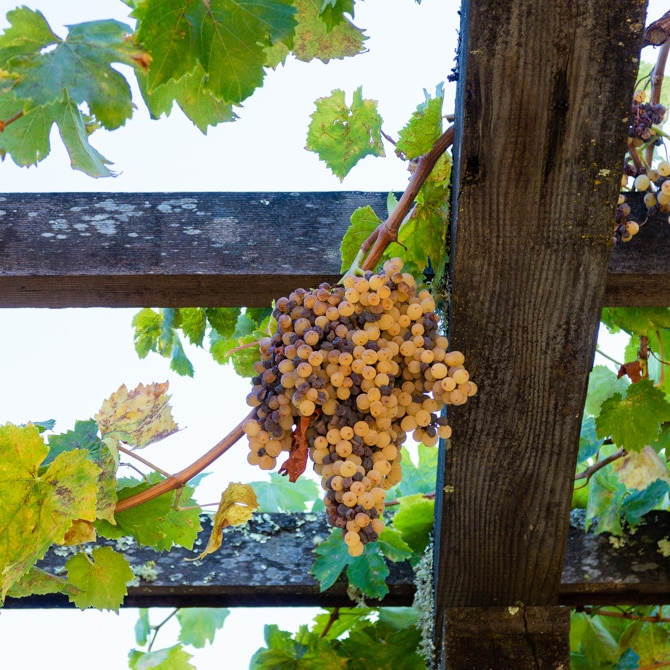
Locate an element on the screen. The height and width of the screenshot is (670, 670). wood planks is located at coordinates (504, 309), (165, 253), (230, 574), (478, 650).